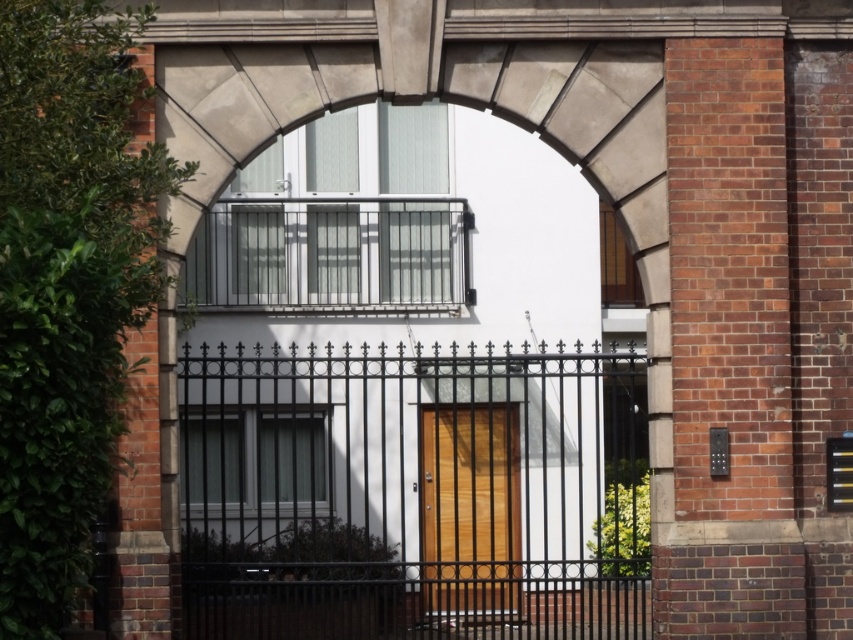
Question: Which point appears closest to the camera in this image?

Choices:
 (A) (503, 525)
 (B) (604, 477)

Answer: (A)

Question: Observing the image, what is the correct spatial positioning of black wrought iron gate at center in reference to metallic silver balcony at upper center?

Choices:
 (A) right
 (B) left

Answer: (A)

Question: Is black wrought iron gate at center positioned at the back of wooden door at center?

Choices:
 (A) yes
 (B) no

Answer: (B)

Question: Estimate the real-world distances between objects in this image. Which object is closer to the wooden door at center?

Choices:
 (A) metallic silver balcony at upper center
 (B) black wrought iron gate at center

Answer: (A)

Question: Does black wrought iron gate at center appear on the right side of metallic silver balcony at upper center?

Choices:
 (A) yes
 (B) no

Answer: (A)

Question: Which object is farther from the camera taking this photo?

Choices:
 (A) metallic silver balcony at upper center
 (B) black wrought iron gate at center
 (C) wooden door at center

Answer: (C)